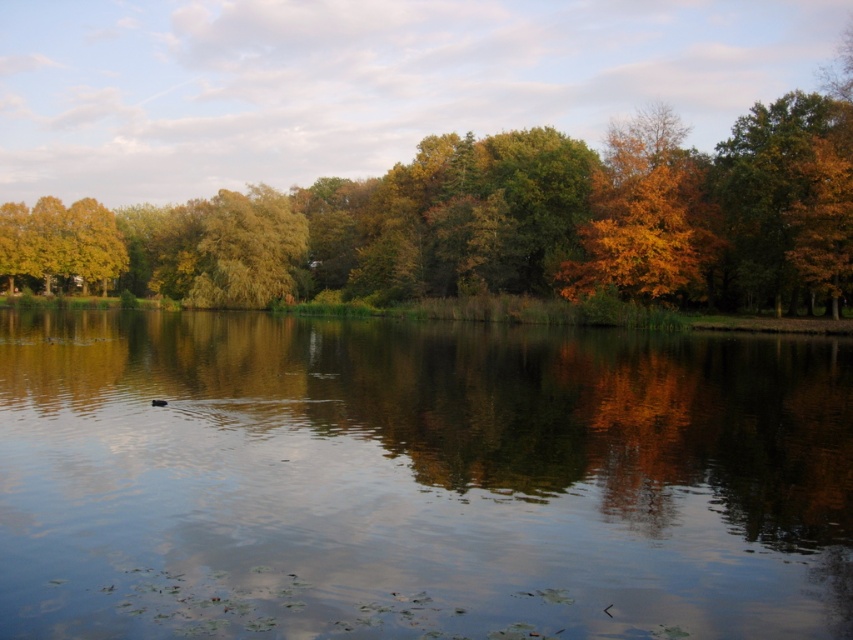
You are standing on a wooden dock and want to toss a small stone into the transparent water at center. However, there is a green leafy tree at center in your way. Can you throw the stone past the tree into the water?

The transparent water at center might be wider than green leafy tree at center, so there could be space to throw the stone around or beside the green leafy tree at center into the transparent water at center.

You are standing on the lakeside path and see the transparent water at center and the green leafy tree at center. Which object is positioned to the right of the other?

The transparent water at center is to the right of the green leafy tree at center according to the description.